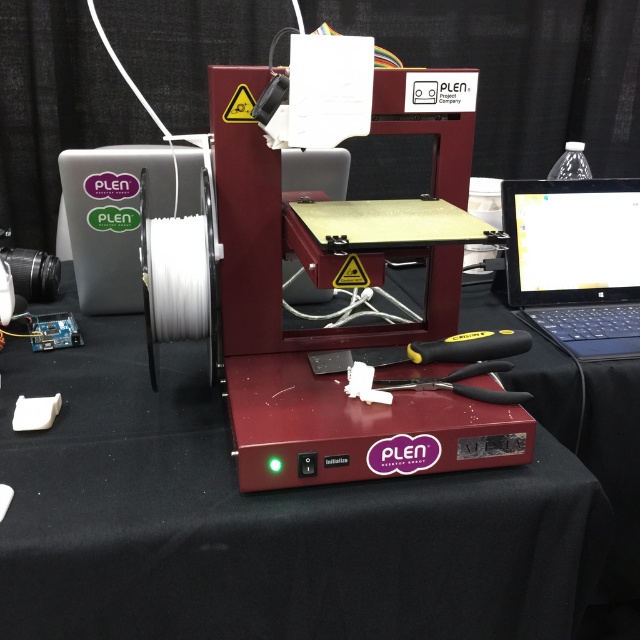
Is yellow rubber handle at center positioned before black plastic pliers at center?

That is False.

Does yellow rubber handle at center have a smaller size compared to black plastic pliers at center?

Yes.

Between point (412, 349) and point (460, 390), which one is positioned behind?

The point (412, 349) is behind.

You are a GUI agent. You are given a task and a screenshot of the screen. Output one action in this format:
    pyautogui.click(x=<x>, y=<y>)
    Task: Click on the yellow rubber handle at center
    This screenshot has height=640, width=640.
    Given the screenshot: What is the action you would take?
    pyautogui.click(x=470, y=346)

Consider the image. Who is positioned more to the left, matte red printer at center or yellow rubber handle at center?

Positioned to the left is matte red printer at center.

Who is more forward, [76,365] or [486,342]?

Point [486,342] is more forward.

Image resolution: width=640 pixels, height=640 pixels. Find the location of `matte red printer at center`. matte red printer at center is located at coordinates (260, 518).

Is black plastic laptop at upper right wider than yellow rubber handle at center?

Yes, black plastic laptop at upper right is wider than yellow rubber handle at center.

This screenshot has width=640, height=640. What do you see at coordinates (576, 260) in the screenshot? I see `black plastic laptop at upper right` at bounding box center [576, 260].

Locate an element on the screen. black plastic laptop at upper right is located at coordinates (576, 260).